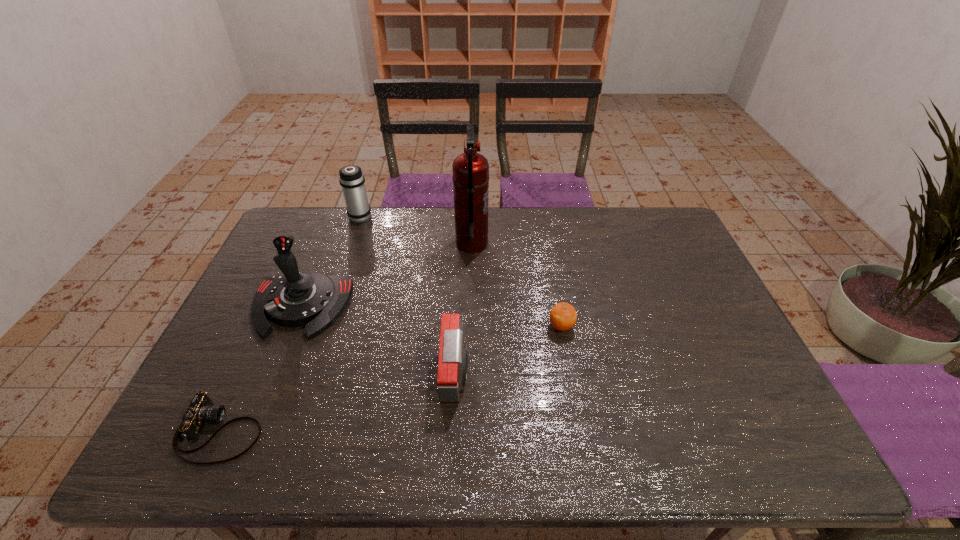
Find the location of a particular element. The width and height of the screenshot is (960, 540). empty space that is in between the tallest object and the joystick is located at coordinates (386, 275).

You are a GUI agent. You are given a task and a screenshot of the screen. Output one action in this format:
    pyautogui.click(x=<x>, y=<y>)
    Task: Click on the empty location between the tallest object and the thermos bottle
    The height and width of the screenshot is (540, 960).
    Given the screenshot: What is the action you would take?
    pyautogui.click(x=417, y=230)

This screenshot has height=540, width=960. I want to click on vacant space that's between the shorter camera and the rightmost object, so click(391, 379).

Locate an element on the screen. vacant area that lies between the rightmost object and the third shortest object is located at coordinates (509, 350).

Identify which object is located as the second nearest to the taller camera. Please provide its 2D coordinates. Your answer should be formatted as a tuple, i.e. [(x, y)], where the tuple contains the x and y coordinates of a point satisfying the conditions above.

[(294, 299)]

Image resolution: width=960 pixels, height=540 pixels. In order to click on object that stands as the second closest to the shorter camera in this screenshot , I will do `click(453, 361)`.

At what (x,y) coordinates should I click in order to perform the action: click on free space that satisfies the following two spatial constraints: 1. on the handle side of the joystick; 2. on the front-facing side of the shortest object. Please return your answer as a coordinate pair (x, y). The width and height of the screenshot is (960, 540). Looking at the image, I should click on (250, 431).

Identify the location of free location that satisfies the following two spatial constraints: 1. on the handle side of the joystick; 2. on the front-facing side of the shorter camera. The width and height of the screenshot is (960, 540). (250, 431).

The image size is (960, 540). Identify the location of free location that satisfies the following two spatial constraints: 1. on the front side of the second shortest object; 2. on the front-facing side of the shortest object. (580, 431).

The width and height of the screenshot is (960, 540). Find the location of `free space in the image that satisfies the following two spatial constraints: 1. on the handle side of the joystick; 2. on the left side of the orange`. free space in the image that satisfies the following two spatial constraints: 1. on the handle side of the joystick; 2. on the left side of the orange is located at coordinates (293, 327).